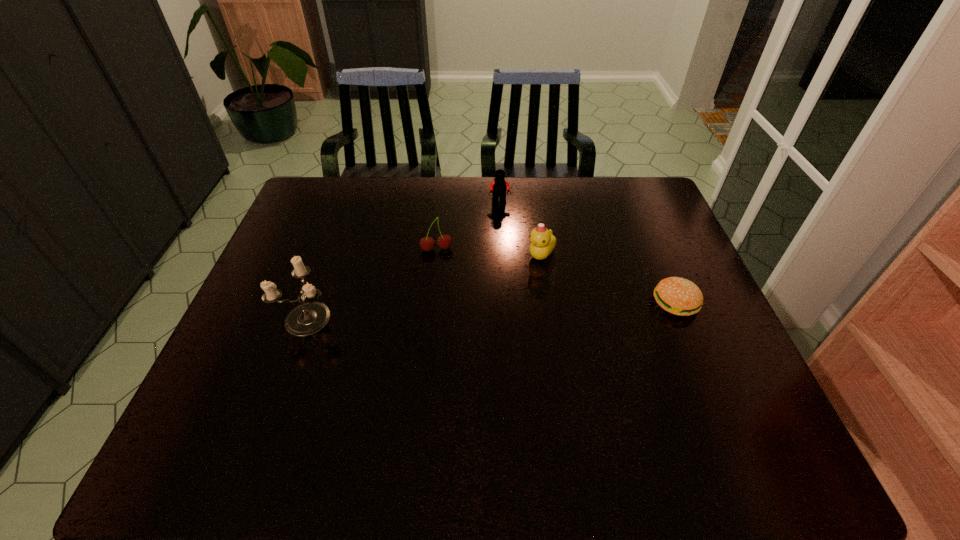
Find the location of a particular element. The height and width of the screenshot is (540, 960). object that is at the left edge is located at coordinates (309, 317).

Locate an element on the screen. Image resolution: width=960 pixels, height=540 pixels. object positioned at the right edge is located at coordinates (x=678, y=296).

I want to click on vacant space at the far edge, so click(x=590, y=184).

Where is `free space at the near edge`? This screenshot has height=540, width=960. free space at the near edge is located at coordinates (585, 409).

The image size is (960, 540). Identify the location of vacant space at the left edge. (288, 256).

In the image, there is a desktop. Where is `free space at the right edge`? free space at the right edge is located at coordinates (712, 327).

At what (x,y) coordinates should I click in order to perform the action: click on free spot between the tallest object and the fourth object from right to left. Please return your answer as a coordinate pair (x, y). The width and height of the screenshot is (960, 540). Looking at the image, I should click on (372, 282).

Where is `free area in between the second object from right to left and the shortest object`? free area in between the second object from right to left and the shortest object is located at coordinates (609, 279).

Where is `blank region between the shortest object and the cherry`? blank region between the shortest object and the cherry is located at coordinates (556, 276).

This screenshot has height=540, width=960. I want to click on vacant space that is in between the cherry and the duckling, so click(x=489, y=252).